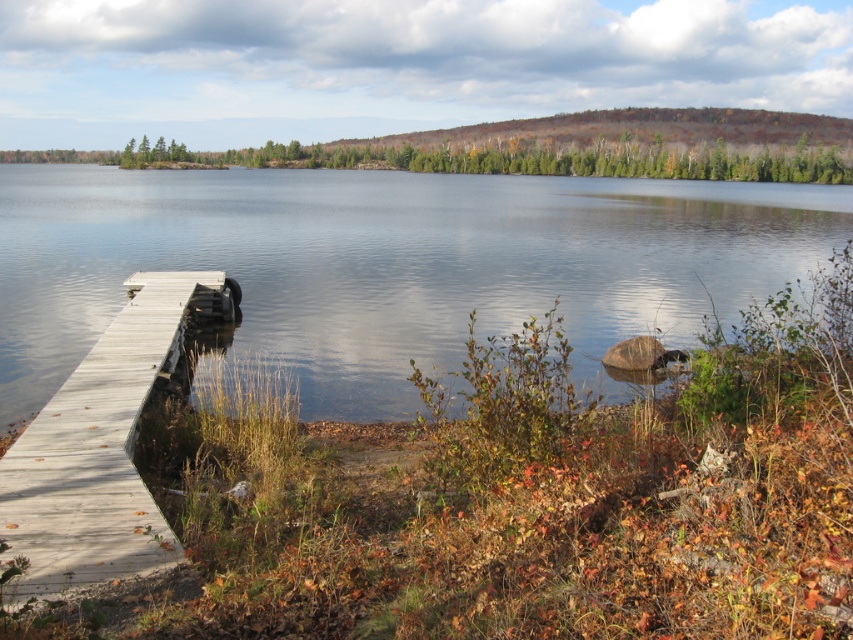
Question: Among these points, which one is farthest from the camera?

Choices:
 (A) (184, 323)
 (B) (253, 176)

Answer: (B)

Question: Does transparent water at center appear over light gray wooden dock at lower left?

Choices:
 (A) no
 (B) yes

Answer: (B)

Question: Which object appears farthest from the camera in this image?

Choices:
 (A) light gray wooden dock at lower left
 (B) transparent water at center

Answer: (B)

Question: Is transparent water at center below light gray wooden dock at lower left?

Choices:
 (A) yes
 (B) no

Answer: (B)

Question: Does transparent water at center have a greater width compared to light gray wooden dock at lower left?

Choices:
 (A) yes
 (B) no

Answer: (A)